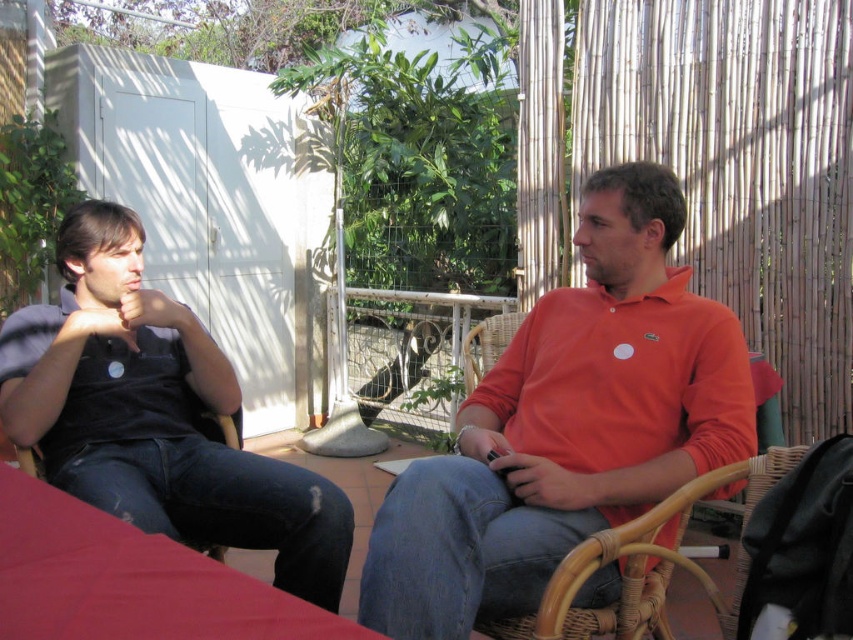
You are a painter standing between the dark blue denim jeans at left and the woven rattan chair at right. You need to paint the higher object first. Which one should you paint first?

The dark blue denim jeans at left has a greater height compared to the woven rattan chair at right, so you should paint the dark blue denim jeans at left first.

You are a delivery person trying to place a package between the dark blue denim jeans at left and the woven rattan chair at right. The package requires 3 feet of space. Do you have enough space to place it there?

The dark blue denim jeans at left and woven rattan chair at right are 3.31 feet apart from each other, so yes, the package can be placed between them since the space is sufficient.